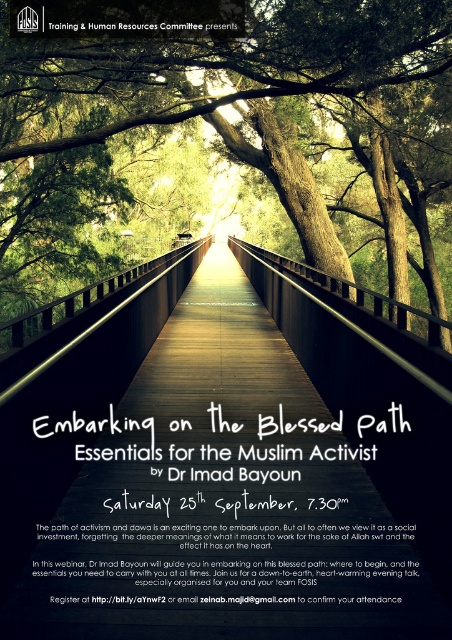
Question: Considering the relative positions of wooden bridge at center and green wood bridge at center in the image provided, where is wooden bridge at center located with respect to green wood bridge at center?

Choices:
 (A) above
 (B) below

Answer: (B)

Question: Can you confirm if wooden bridge at center is positioned below green wood bridge at center?

Choices:
 (A) yes
 (B) no

Answer: (A)

Question: Among these objects, which one is farthest from the camera?

Choices:
 (A) green wood bridge at center
 (B) wooden bridge at center

Answer: (A)

Question: In this image, where is wooden bridge at center located relative to green wood bridge at center?

Choices:
 (A) below
 (B) above

Answer: (A)